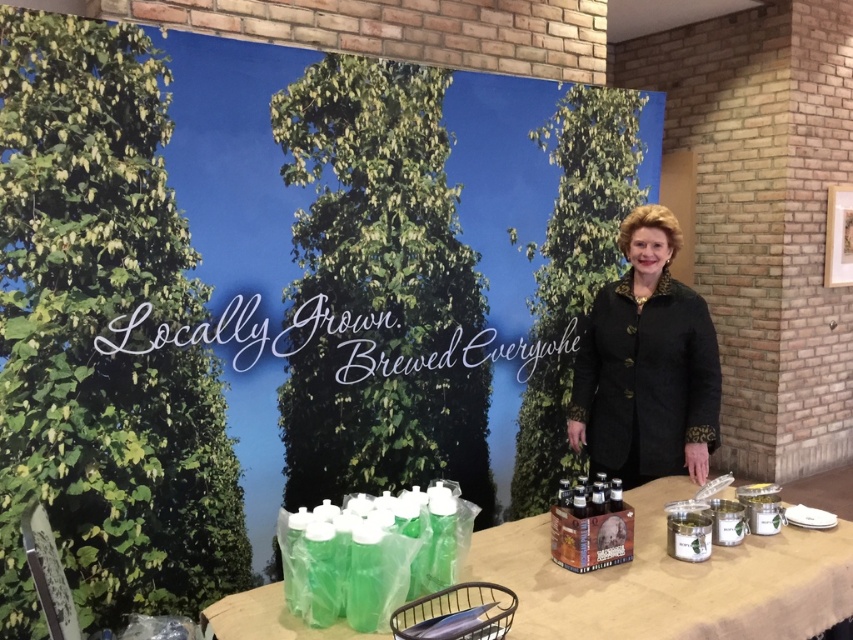
You are organizing an event and need to place a large decorative item on the table. The black textured coat at center and the green plastic bottles at lower left are already there. Which object should you move to make space?

The black textured coat at center is larger in size than the green plastic bottles at lower left, so you should move the black textured coat at center to make space for the large decorative item.

Consider the image. You are organizing a promotional event and need to place a new item between the black textured coat at center and the green plastic bottles at lower left on the table. Based on their widths, which object should be placed closer to the edge of the table to ensure the new item fits comfortably?

The black textured coat at center has a lesser width compared to the green plastic bottles at lower left. To ensure the new item fits comfortably between them, place the black textured coat at center closer to the edge since it takes up less space, allowing more room for the new item between them and the bottles.

You are attending an event and need to find the black textured coat at center. According to the spatial description, where exactly is it positioned on the image?

The black textured coat at center is located at point coordinates 0.570 on the x axis and 0.758 on the y axis.